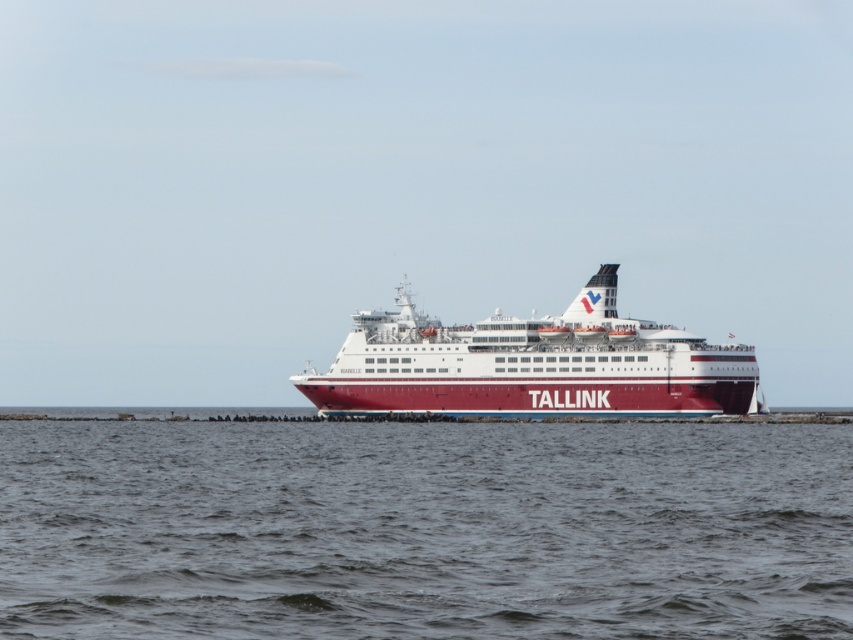
The image size is (853, 640). What are the coordinates of `gray water at center` in the screenshot? It's located at tap(424, 529).

Does gray water at center have a greater width compared to red polished ship at center?

Correct, the width of gray water at center exceeds that of red polished ship at center.

Between point (222, 528) and point (397, 372), which one is positioned behind?

Positioned behind is point (397, 372).

Identify the location of gray water at center. Image resolution: width=853 pixels, height=640 pixels. (424, 529).